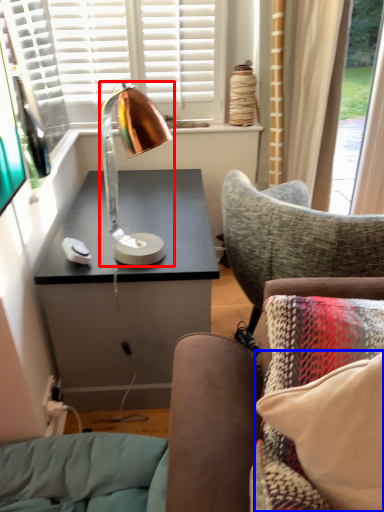
Question: Which of the following is the farthest to the observer, lamp (highlighted by a red box) or pillow (highlighted by a blue box)?

Choices:
 (A) lamp
 (B) pillow

Answer: (A)